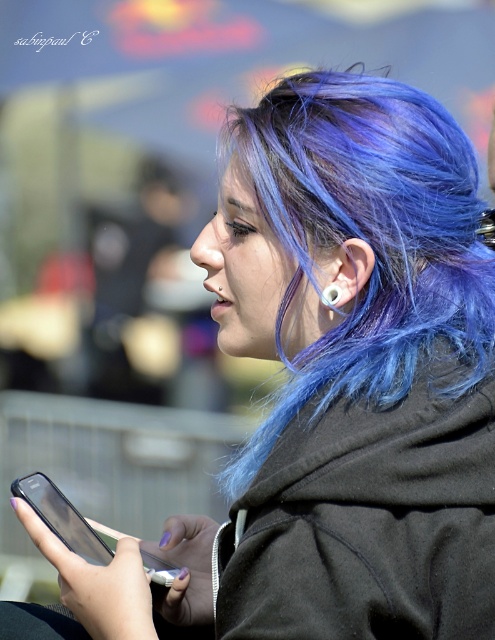
You are a photographer adjusting the focus of your camera. You want to capture both the blue dyed hair at center and the silver metallic earring at ear in sharp detail. Given that your camera can only focus on objects within a 5 inch range, will both objects be in focus?

The blue dyed hair at center and silver metallic earring at ear are 6.87 inches apart from each other. Since the distance between them exceeds the camera focus range of 5 inches, both objects cannot be in focus simultaneously.

Looking at the person in the image, which object is positioned to the left of the other between the blue dyed hair at center and the silver metallic earring at ear?

The blue dyed hair at center is to the left of the silver metallic earring at ear.

You are a photographer trying to capture the person holding the smartphone. You want to focus on the point at point (313, 195) and point (331, 284). Which point should you focus on first to ensure the subject remains sharp?

Point (313, 195) is in front of point (331, 284), so you should focus on point (313, 195) first to ensure the subject remains sharp.